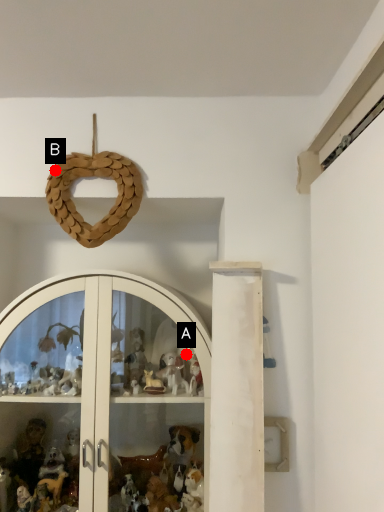
Question: Two points are circled on the image, labeled by A and B beside each circle. Which point appears closest to the camera in this image?

Choices:
 (A) A is closer
 (B) B is closer

Answer: (B)